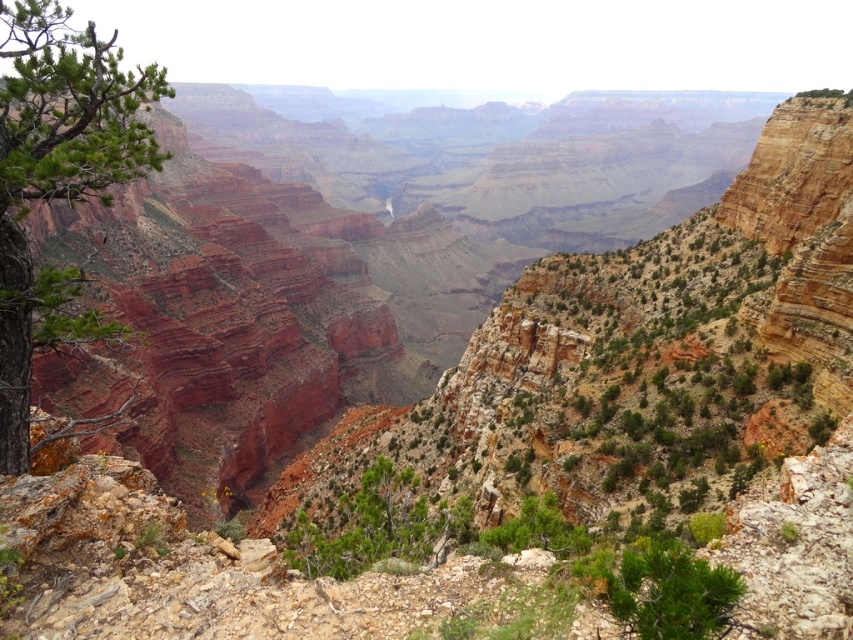
Can you confirm if green textured pine tree at left is bigger than green rough textured bush at lower right?

Indeed, green textured pine tree at left has a larger size compared to green rough textured bush at lower right.

Is green textured pine tree at left shorter than green rough textured bush at lower right?

No, green textured pine tree at left is not shorter than green rough textured bush at lower right.

Locate an element on the screen. green textured pine tree at left is located at coordinates (57, 182).

You are a GUI agent. You are given a task and a screenshot of the screen. Output one action in this format:
    pyautogui.click(x=<x>, y=<y>)
    Task: Click on the green textured pine tree at left
    
    Given the screenshot: What is the action you would take?
    pyautogui.click(x=57, y=182)

Which is more to the left, green textured pine tree at left or green matte tree at center?

green textured pine tree at left is more to the left.

Does point (24, 12) come farther from viewer compared to point (345, 577)?

No, (24, 12) is in front of (345, 577).

This screenshot has height=640, width=853. I want to click on green textured pine tree at left, so click(57, 182).

Is point (403, 476) behind point (728, 620)?

Yes, point (403, 476) is behind point (728, 620).

Where is `green matte tree at center`? green matte tree at center is located at coordinates (375, 525).